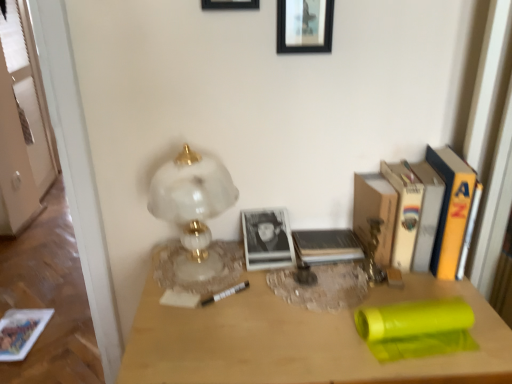
Identify the location of vacant area that lies to the right of matte paper book at lower left. (53, 334).